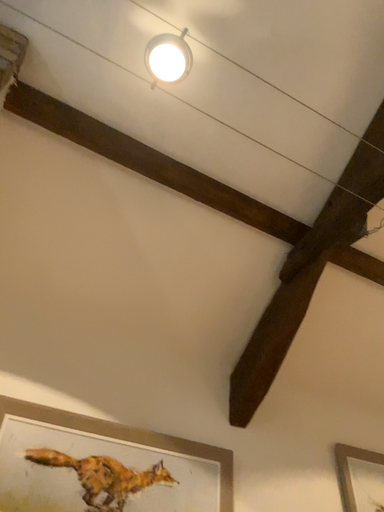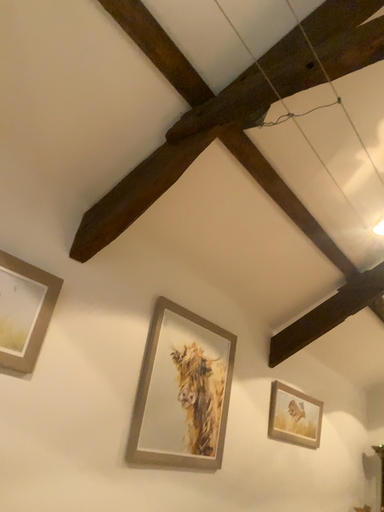
Question: How did the camera likely rotate when shooting the video?

Choices:
 (A) rotated downward
 (B) rotated upward

Answer: (A)